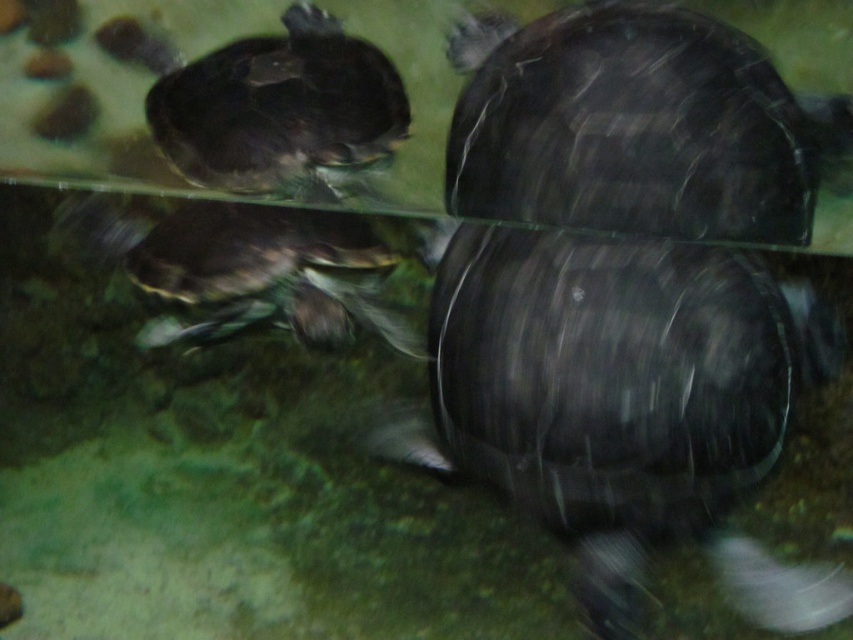
Which is more to the left, shiny black tortoise at center or shiny black tortoise at upper center?

shiny black tortoise at upper center is more to the left.

Is shiny black tortoise at center smaller than shiny black tortoise at upper center?

No, shiny black tortoise at center is not smaller than shiny black tortoise at upper center.

You are a GUI agent. You are given a task and a screenshot of the screen. Output one action in this format:
    pyautogui.click(x=<x>, y=<y>)
    Task: Click on the shiny black tortoise at center
    The width and height of the screenshot is (853, 640).
    Given the screenshot: What is the action you would take?
    pyautogui.click(x=624, y=403)

The width and height of the screenshot is (853, 640). Find the location of `shiny black tortoise at center`. shiny black tortoise at center is located at coordinates (624, 403).

Is shiny black tortoise at upper center smaller than shiny dark green tortoise at center?

Incorrect, shiny black tortoise at upper center is not smaller in size than shiny dark green tortoise at center.

Does point (370, 115) come in front of point (172, 250)?

No, (370, 115) is behind (172, 250).

Locate an element on the screen. Image resolution: width=853 pixels, height=640 pixels. shiny black tortoise at upper center is located at coordinates (282, 113).

Image resolution: width=853 pixels, height=640 pixels. What are the coordinates of `shiny black tortoise at upper center` in the screenshot? It's located at (282, 113).

Who is positioned more to the right, shiny black tortoise at center or shiny dark green tortoise at center?

shiny black tortoise at center

Looking at this image, is shiny black tortoise at center to the left of shiny dark green tortoise at center from the viewer's perspective?

Incorrect, shiny black tortoise at center is not on the left side of shiny dark green tortoise at center.

Where is `shiny black tortoise at center`? This screenshot has height=640, width=853. shiny black tortoise at center is located at coordinates (624, 403).